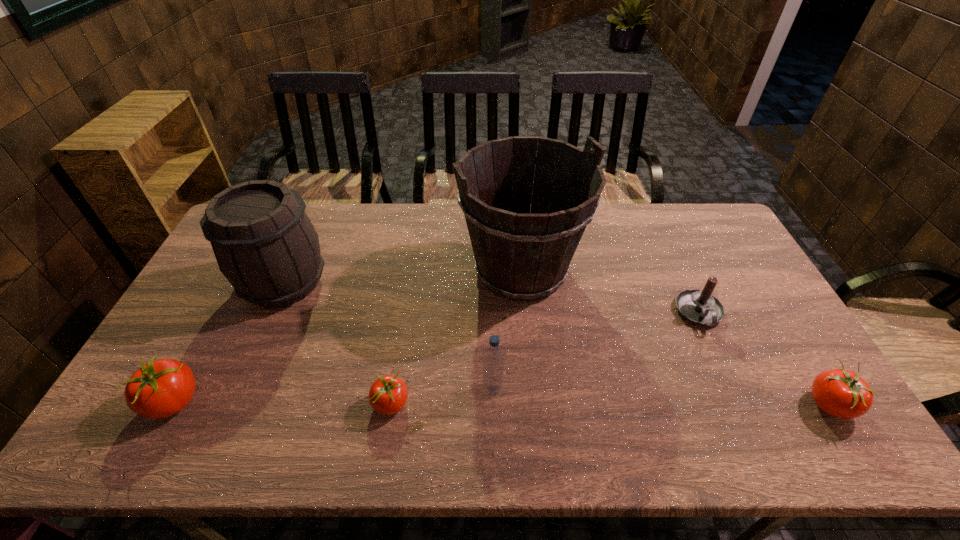
If the aim is uniform spacing by inserting an additional tomato among them, please point to a vacant space for this new tomato. Please provide its 2D coordinates. Your answer should be formatted as a tuple, i.e. [(x, y)], where the tuple contains the x and y coordinates of a point satisfying the conditions above.

[(611, 404)]